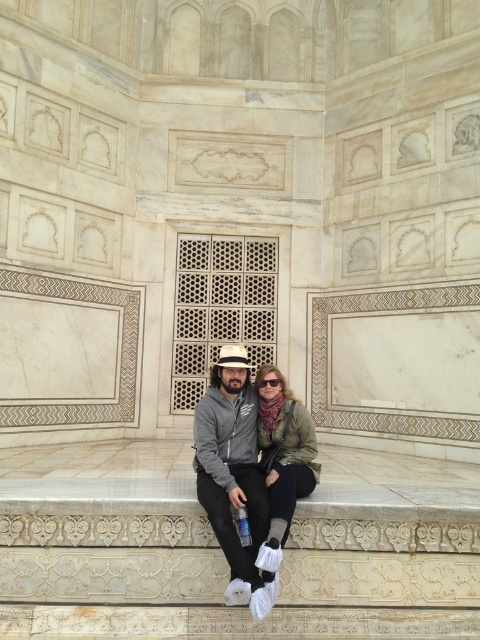
Which is more to the left, matte gray hoodie at center or green textured jacket at center?

matte gray hoodie at center

Is point (265, 502) positioned behind point (267, 557)?

Yes, it is.

Which is behind, point (223, 356) or point (269, 380)?

The point (269, 380) is more distant.

The height and width of the screenshot is (640, 480). Identify the location of matte gray hoodie at center. (237, 476).